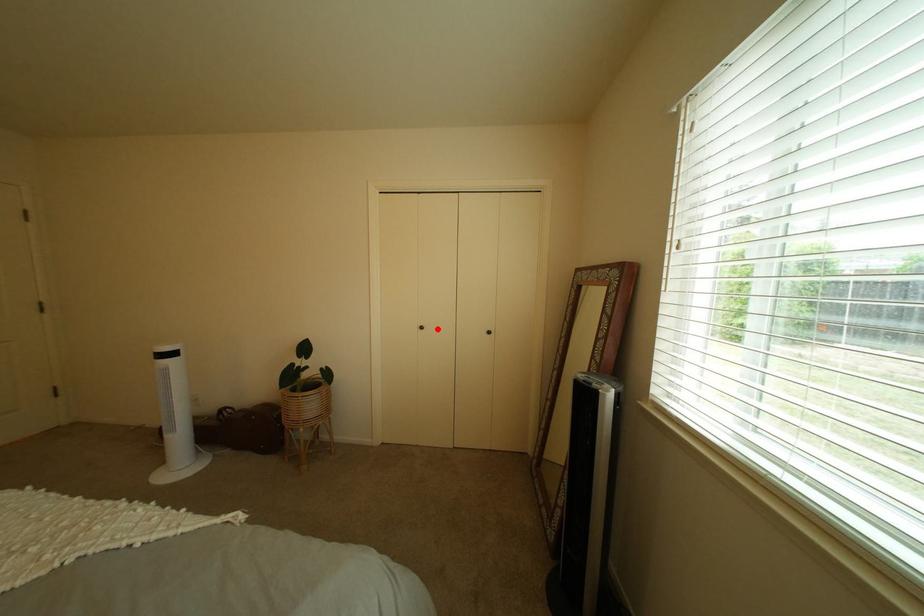
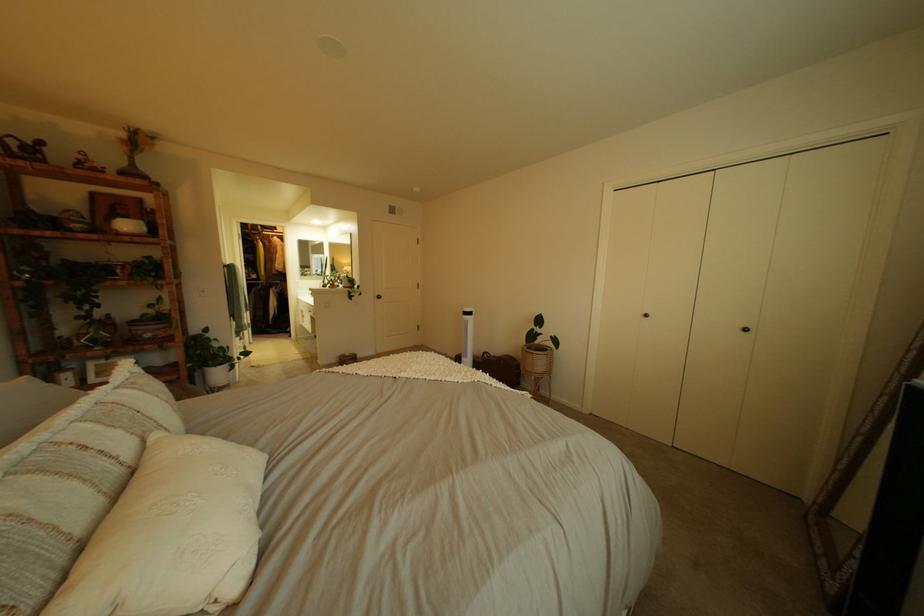
In the second image, find the point that corresponds to the highlighted location in the first image.

(662, 317)